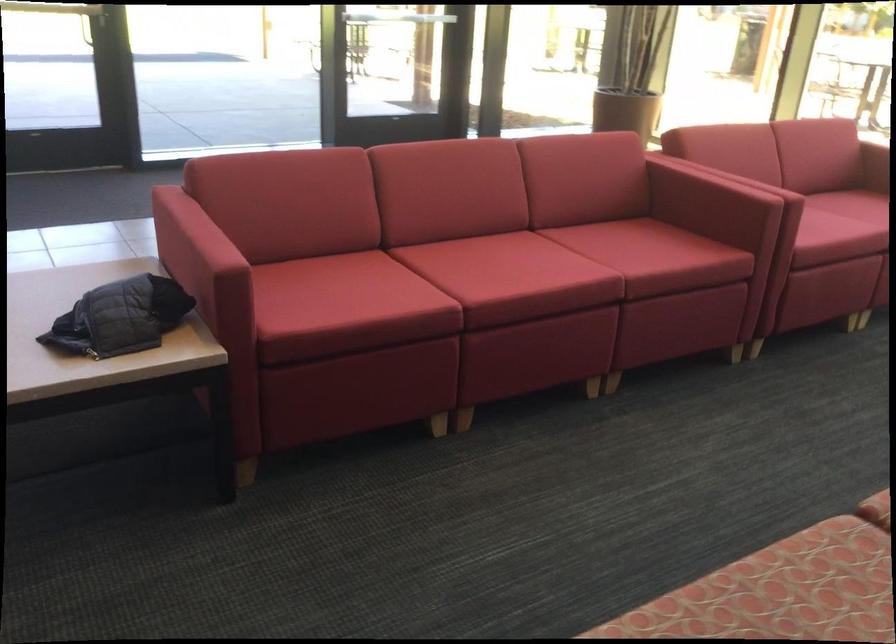
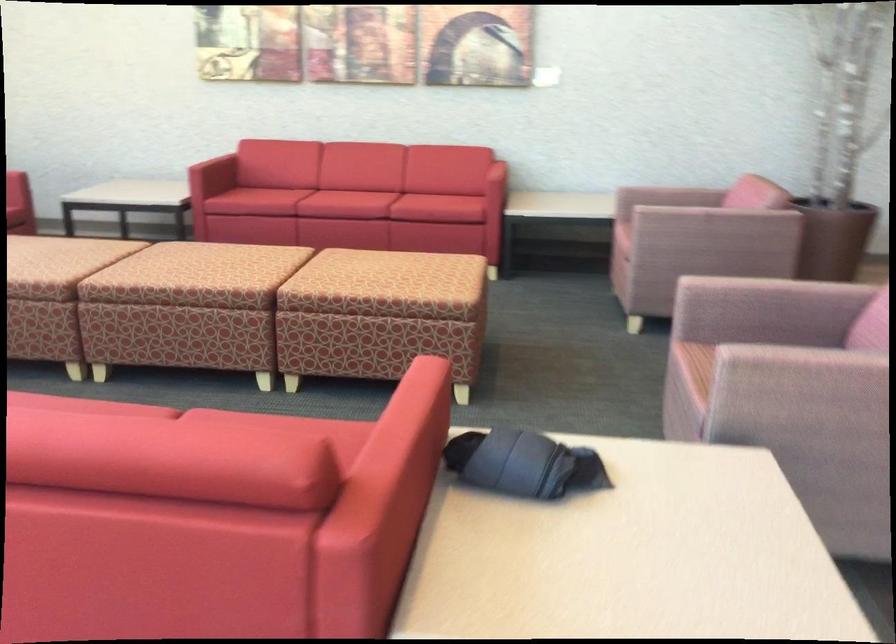
Find the pixel in the second image that matches the point at 127,279 in the first image.

(522, 464)